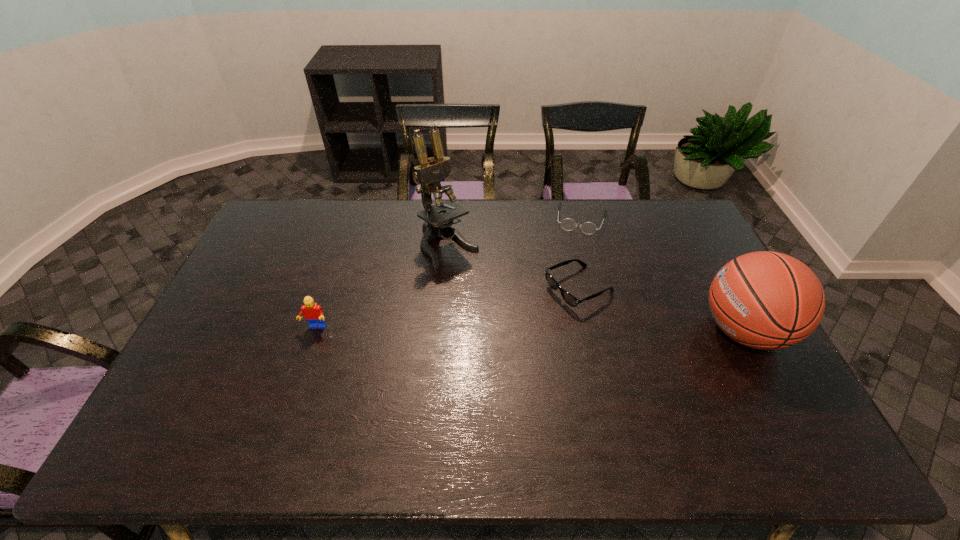
You are a GUI agent. You are given a task and a screenshot of the screen. Output one action in this format:
    pyautogui.click(x=<x>, y=<y>)
    Task: Click on the free space located through the lenses of the shortest object
    The width and height of the screenshot is (960, 540).
    Given the screenshot: What is the action you would take?
    pyautogui.click(x=565, y=292)

Find the location of `free space located 0.380m through the lenses of the shortest object`. free space located 0.380m through the lenses of the shortest object is located at coordinates [561, 312].

I want to click on microscope positioned at the far edge, so click(x=428, y=174).

Find the location of `spectacles that is at the far edge`. spectacles that is at the far edge is located at coordinates (567, 224).

You are a GUI agent. You are given a task and a screenshot of the screen. Output one action in this format:
    pyautogui.click(x=<x>, y=<y>)
    Task: Click on the object located in the right edge section of the desktop
    The height and width of the screenshot is (540, 960).
    Given the screenshot: What is the action you would take?
    pyautogui.click(x=766, y=300)

This screenshot has height=540, width=960. Identify the location of free region at the far edge of the desktop. coord(400,232).

Locate an element on the screen. free location at the near edge is located at coordinates (588, 405).

What are the coordinates of `vacant region at the left edge of the desktop` in the screenshot? It's located at (230, 284).

You are a GUI agent. You are given a task and a screenshot of the screen. Output one action in this format:
    pyautogui.click(x=<x>, y=<y>)
    Task: Click on the blank space at the right edge of the desktop
    This screenshot has width=960, height=540.
    Given the screenshot: What is the action you would take?
    pyautogui.click(x=711, y=279)

Identify the location of vacant area at the far left corner of the desktop. The height and width of the screenshot is (540, 960). (303, 203).